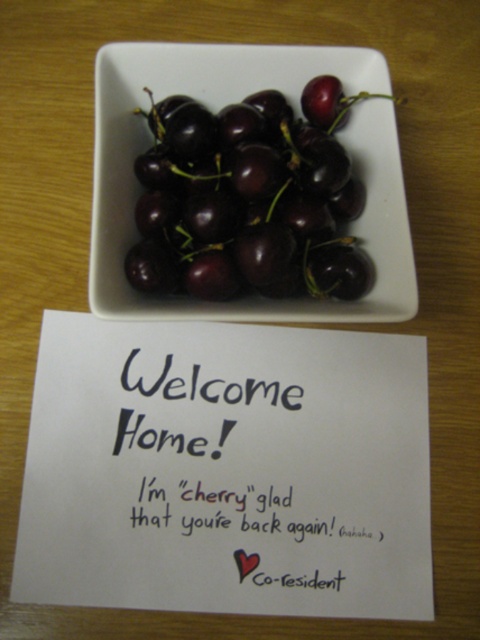
You are a delivery person who just arrived at the doorstep. You see the shiny dark red cherries at center and the black paper at upper center. Which object is wider?

The shiny dark red cherries at center are wider than the black paper at upper center.

You are standing at the edge of the wooden surface and want to place a new decorative item exactly where the shiny dark red cherries at center are currently located. According to the coordinates provided, what are the coordinates you should aim for?

The coordinates you should aim for are 0.312 in the x direction and 0.519 in the y direction, as the shiny dark red cherries at center are located at point [249,198].

Based on the photo, you are a photographer trying to capture the shiny dark red cherries at center. If your camera can focus on objects up to 24 inches away, will the cherries be in focus?

The shiny dark red cherries at center are 24.44 inches away from the camera, which is beyond the camera focus limit of 24 inches. Therefore, the cherries will not be in focus.